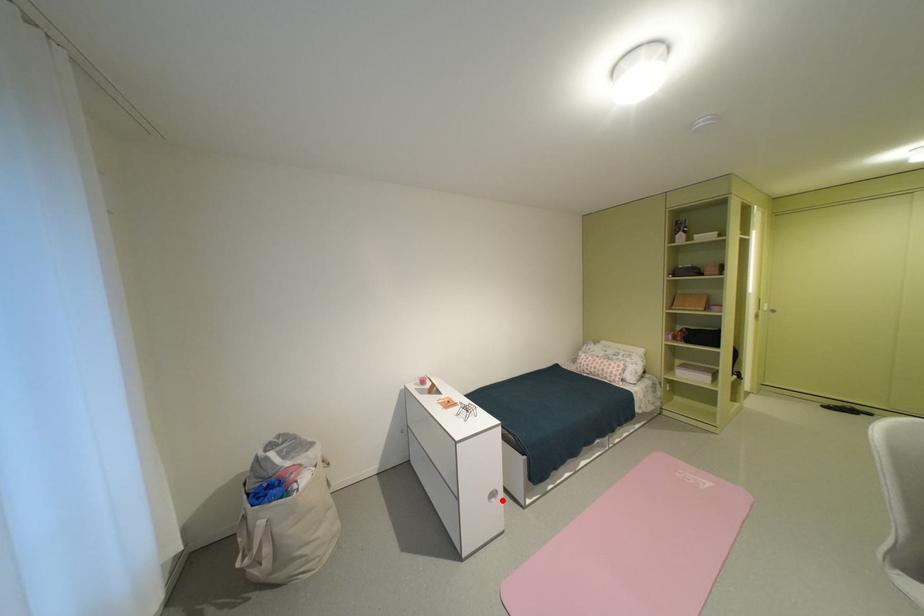
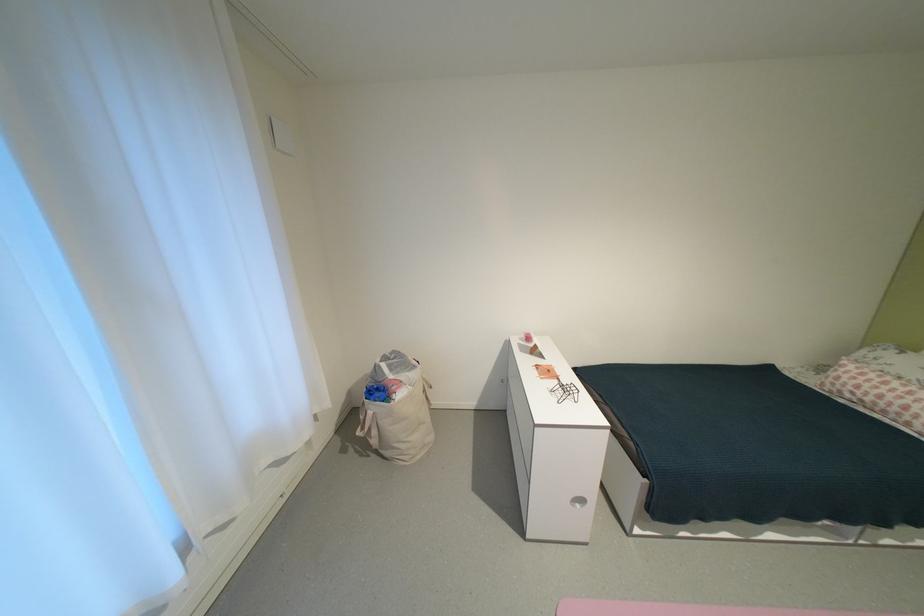
Question: I am providing you with two images of the same scene from different viewpoints. A red point is shown in image1. For the corresponding object point in image2, is it positioned nearer or farther from the camera?

Choices:
 (A) Nearer
 (B) Farther

Answer: (B)